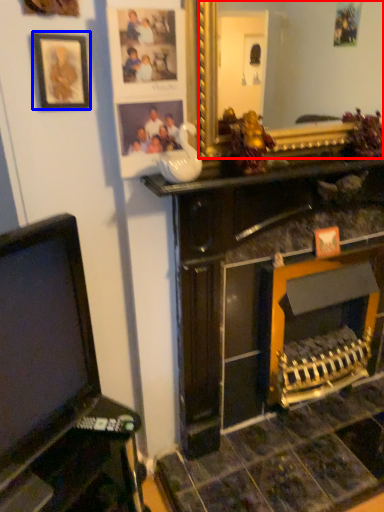
Question: Among these objects, which one is nearest to the camera, mirror (highlighted by a red box) or picture frame (highlighted by a blue box)?

Choices:
 (A) mirror
 (B) picture frame

Answer: (B)